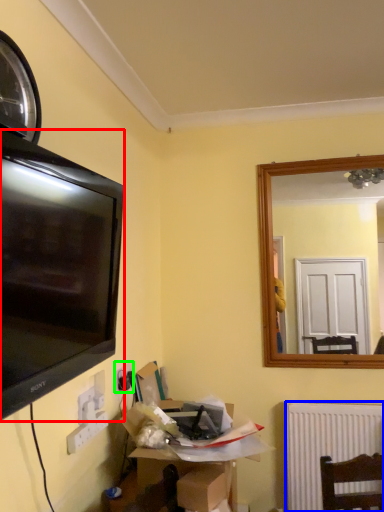
Question: Estimate the real-world distances between objects in this image. Which object is closer to television (highlighted by a red box), radiator (highlighted by a blue box) or electric outlet (highlighted by a green box)?

Choices:
 (A) radiator
 (B) electric outlet

Answer: (B)